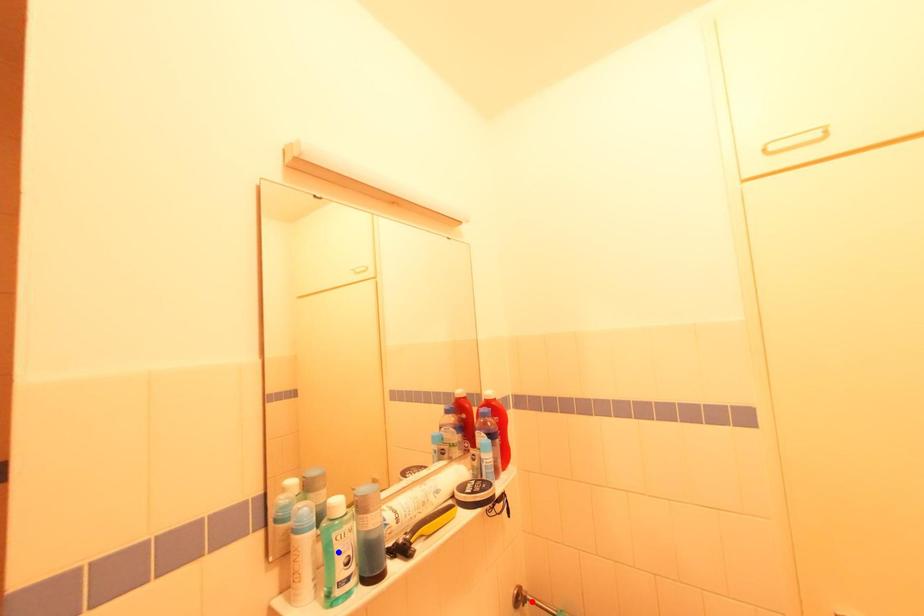
Question: Two points are marked on the image. Which point is closer to the camera?

Choices:
 (A) Blue point is closer.
 (B) Red point is closer.

Answer: (A)